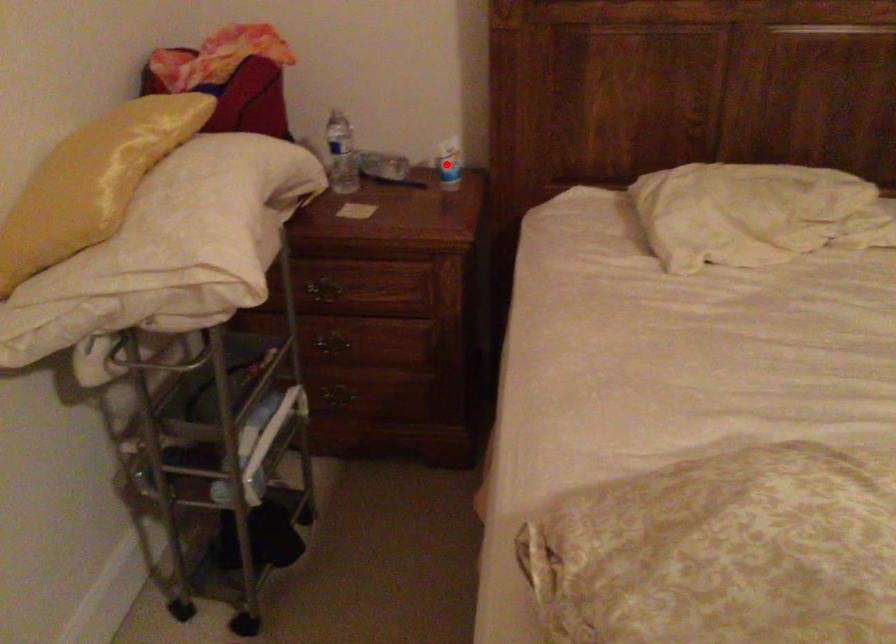
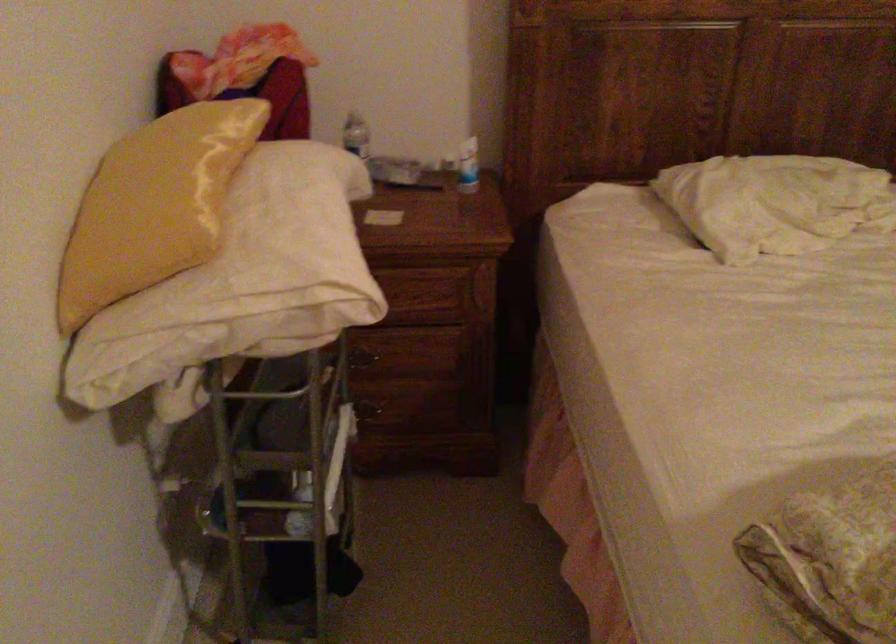
Question: I am providing you with two images of the same scene from different viewpoints. A red point is marked on the first image. Can you still see the location of the red point in image 2?

Choices:
 (A) Yes
 (B) No

Answer: (A)